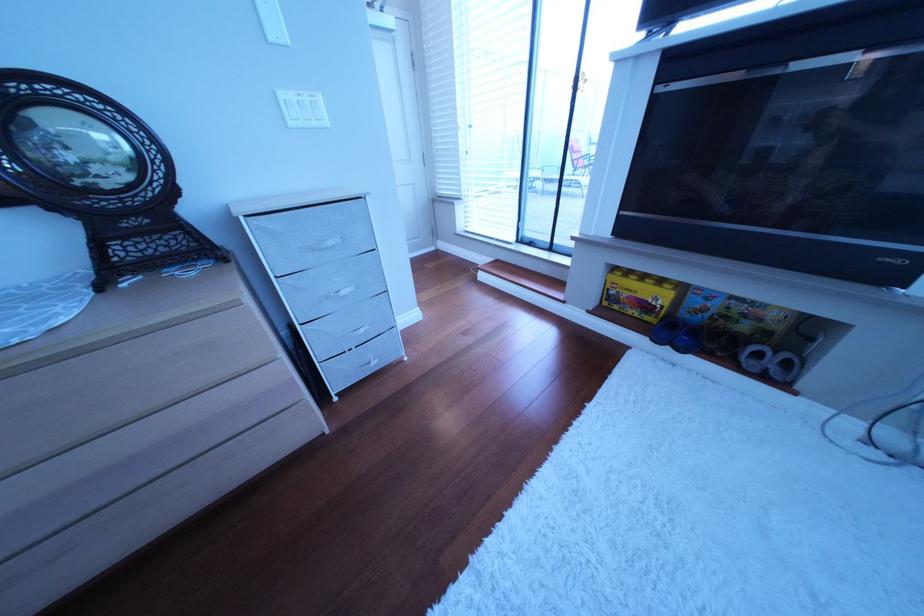
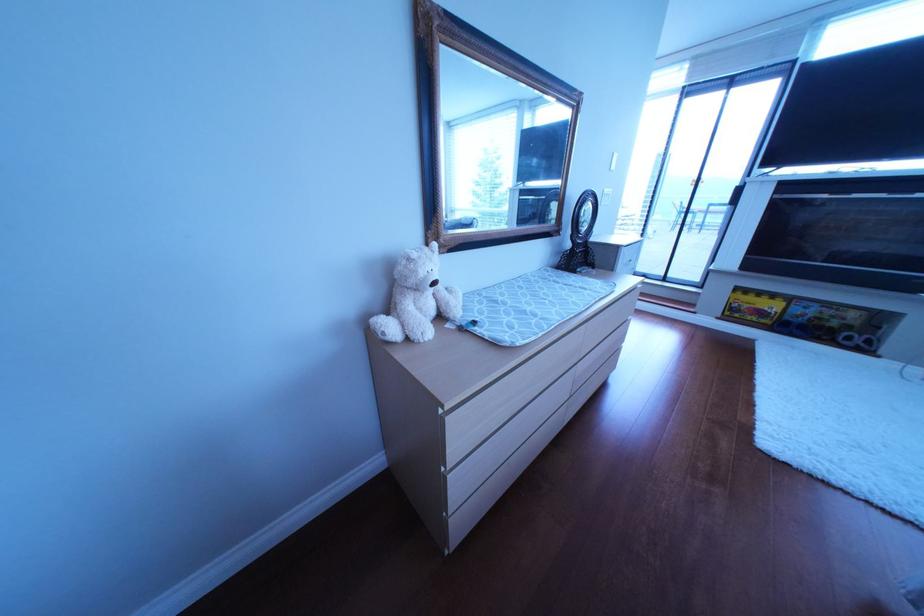
In a continuous first-person perspective shot, in which direction is the camera moving?

The cameraman walked toward left, backward.